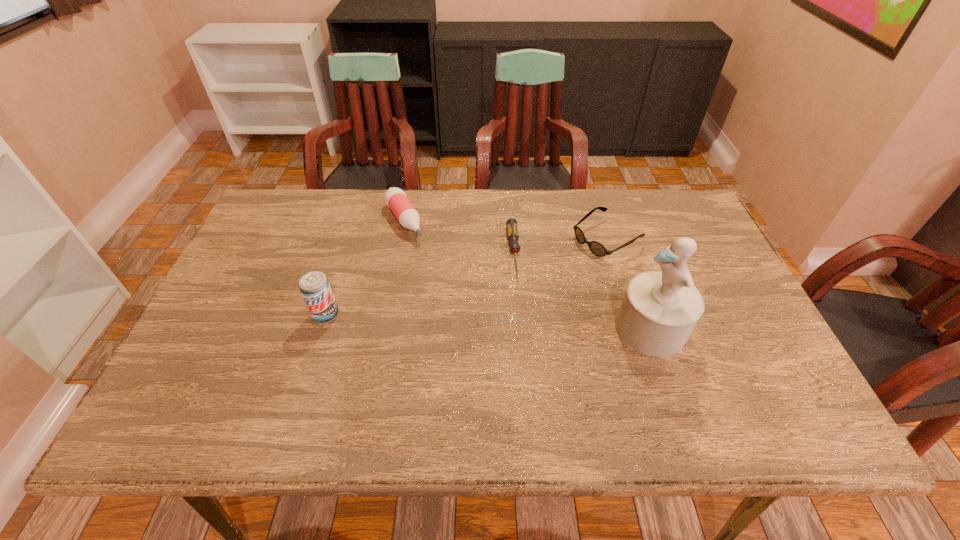
Find the location of a particular element. This screenshot has height=540, width=960. vacant region at the near right corner of the desktop is located at coordinates (737, 395).

Find the location of `free space between the third object from left to right and the tallest object`. free space between the third object from left to right and the tallest object is located at coordinates (583, 291).

Where is `free point between the second tallest object and the sunglasses`? The height and width of the screenshot is (540, 960). free point between the second tallest object and the sunglasses is located at coordinates (467, 276).

Identify the location of vacant point located between the bottle and the fourth tallest object. This screenshot has width=960, height=540. (506, 230).

Image resolution: width=960 pixels, height=540 pixels. I want to click on vacant region between the screwdriver and the beer can, so click(420, 284).

Identify the location of blank region between the second object from left to right and the fourth tallest object. This screenshot has height=540, width=960. (506, 230).

Where is `vacant region between the bottle and the fourth shortest object`? The image size is (960, 540). vacant region between the bottle and the fourth shortest object is located at coordinates (365, 268).

Image resolution: width=960 pixels, height=540 pixels. I want to click on vacant space that's between the beer can and the third object from left to right, so click(x=420, y=284).

Where is `free space between the fourth shortest object and the second shortest object`? free space between the fourth shortest object and the second shortest object is located at coordinates (467, 276).

At what (x,y) coordinates should I click in order to perform the action: click on free point between the bottle and the shortest object. Please return your answer as a coordinate pair (x, y). This screenshot has height=540, width=960. Looking at the image, I should click on (459, 237).